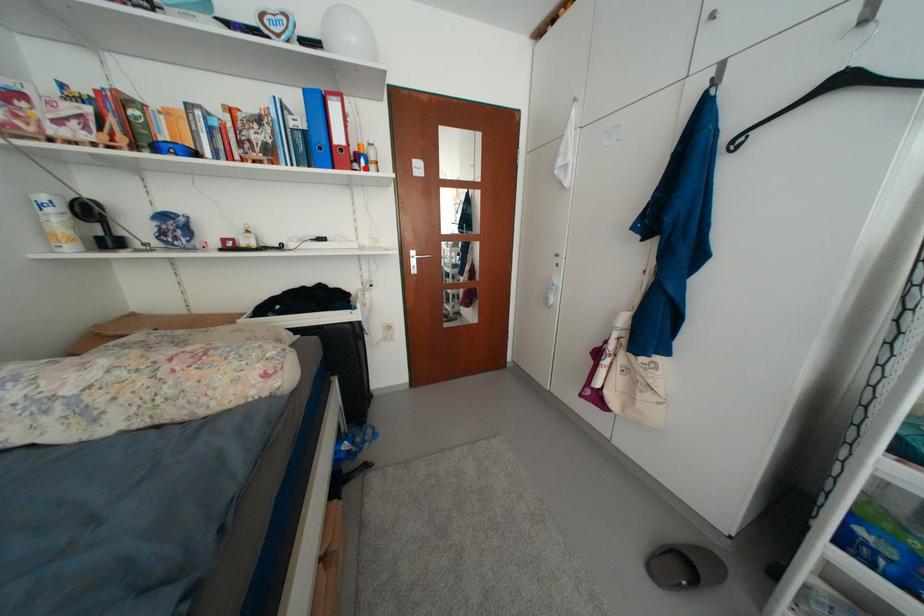
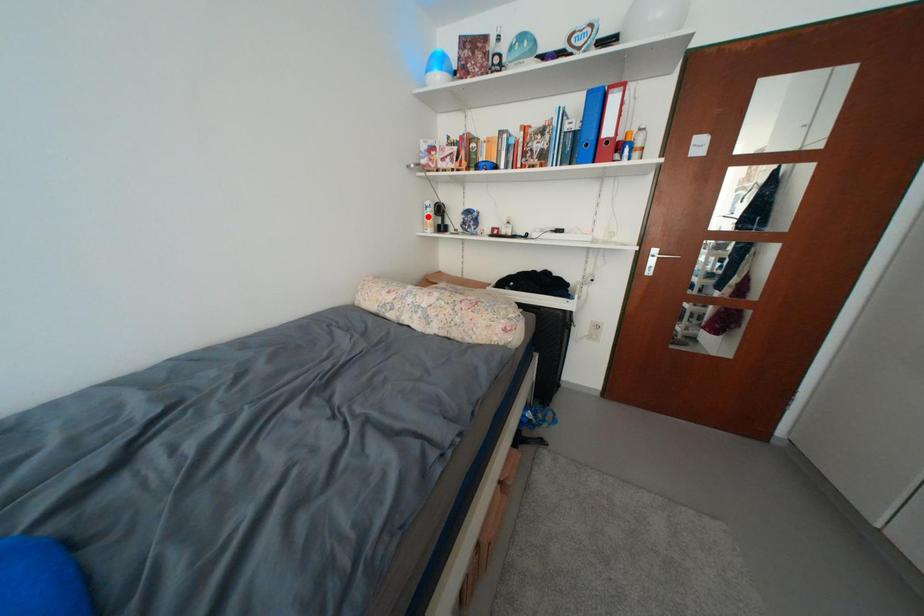
I am providing you with two images of the same scene from different viewpoints. A red point is marked on the first image and another point is marked on the second image. Is the red point in image1 aligned with the point shown in image2?

No